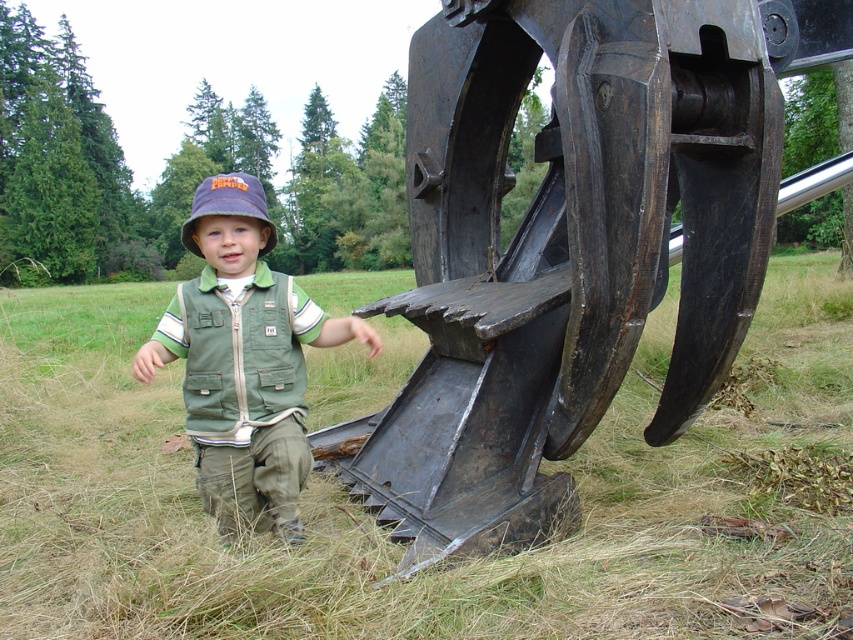
Who is taller, green grass at lower left or rusty metal claw at lower right?

rusty metal claw at lower right is taller.

Which is in front, point (202, 584) or point (519, 472)?

Point (202, 584) is in front.

The image size is (853, 640). I want to click on green grass at lower left, so click(x=390, y=528).

Is point (584, 157) positioned behind point (276, 234)?

No, (584, 157) is in front of (276, 234).

At what (x,y) coordinates should I click in order to perform the action: click on rusty metal claw at lower right. Please return your answer as a coordinate pair (x, y). Looking at the image, I should click on (572, 243).

Is green fabric vest at center above purple fabric bucket hat at center?

No.

Is green fabric vest at center further to the viewer compared to purple fabric bucket hat at center?

No, it is not.

At what (x,y) coordinates should I click in order to perform the action: click on green fabric vest at center. Please return your answer as a coordinate pair (x, y). Looking at the image, I should click on (242, 360).

I want to click on green fabric vest at center, so click(x=242, y=360).